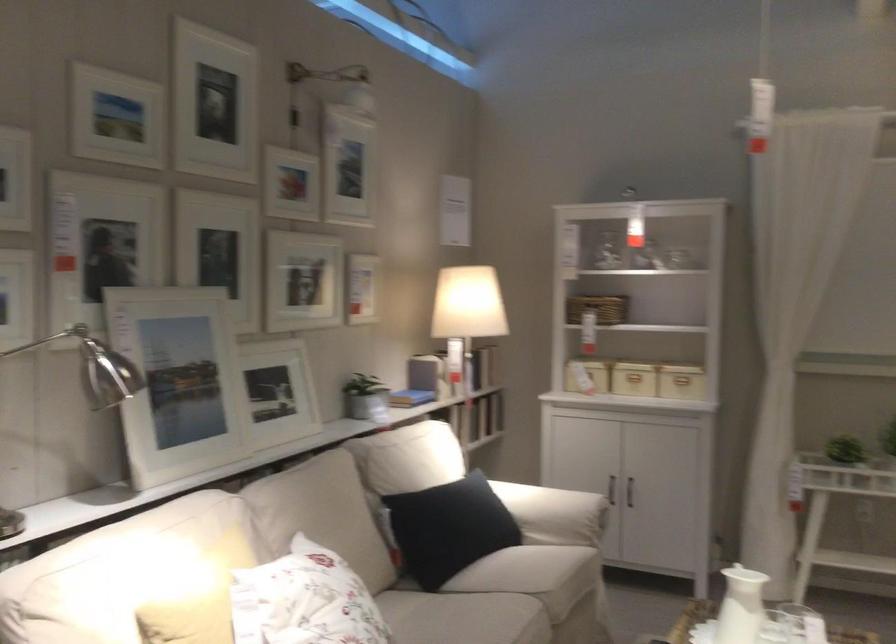
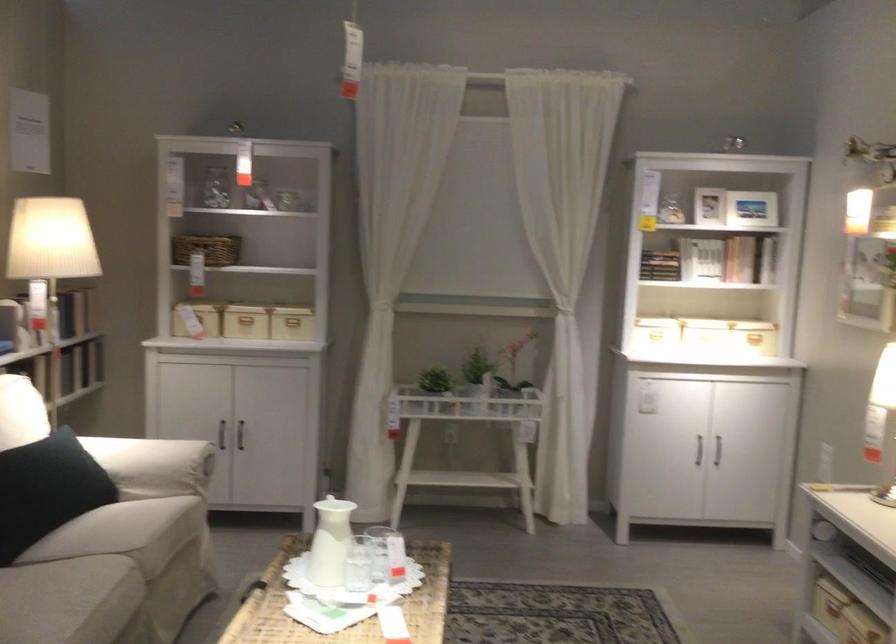
Locate, in the second image, the point that corresponds to pixel 464 527 in the first image.

(47, 489)